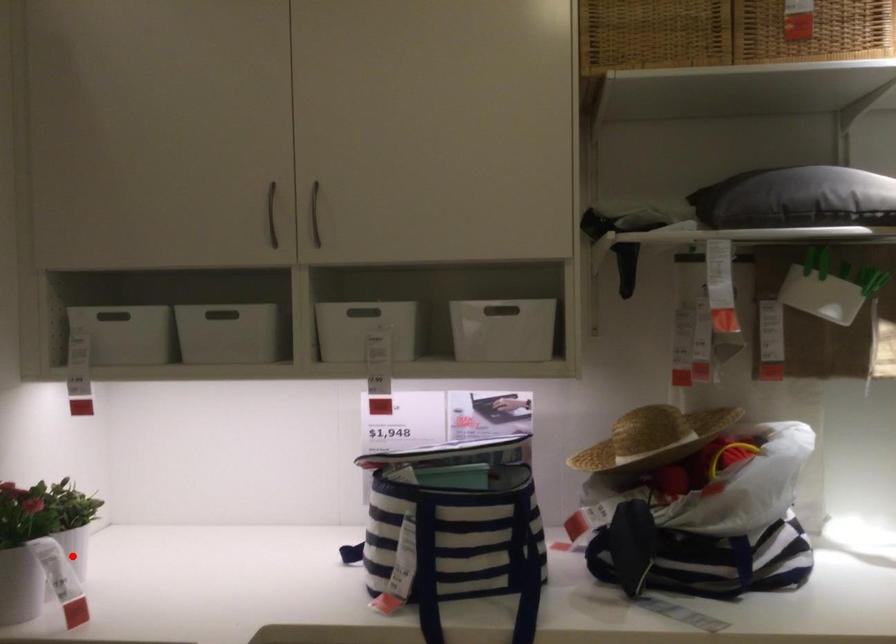
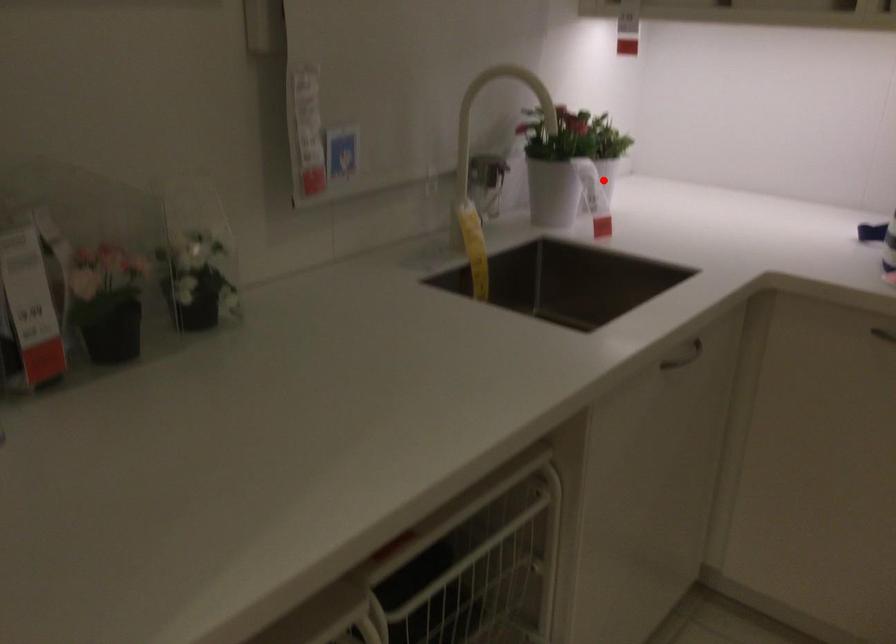
I am providing you with two images of the same scene from different viewpoints. A red point is marked on the first image and another point is marked on the second image. Are the points marked in image1 and image2 representing the same 3D position?

Yes